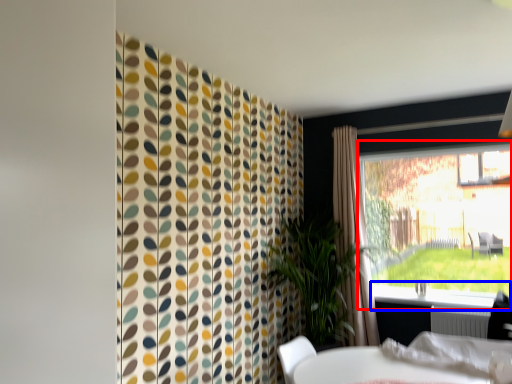
Question: Which of the following is the farthest to the observer, window (highlighted by a red box) or window sill (highlighted by a blue box)?

Choices:
 (A) window
 (B) window sill

Answer: (A)